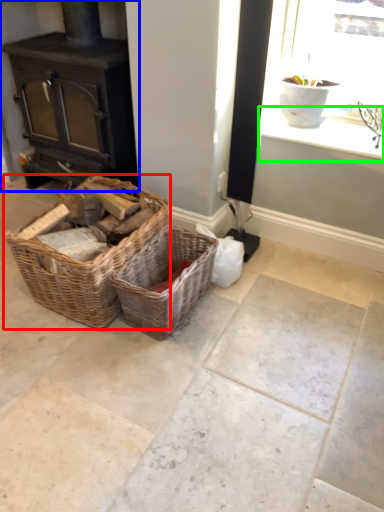
Question: Which object is positioned closest to picnic basket (highlighted by a red box)? Select from wood burning stove (highlighted by a blue box) and window sill (highlighted by a green box).

Choices:
 (A) wood burning stove
 (B) window sill

Answer: (A)